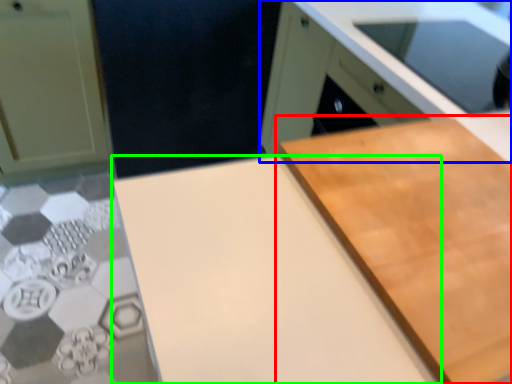
Question: Which object is positioned farthest from cutting board (highlighted by a red box)? Select from cabinetry (highlighted by a blue box) and counter top (highlighted by a green box).

Choices:
 (A) cabinetry
 (B) counter top

Answer: (A)